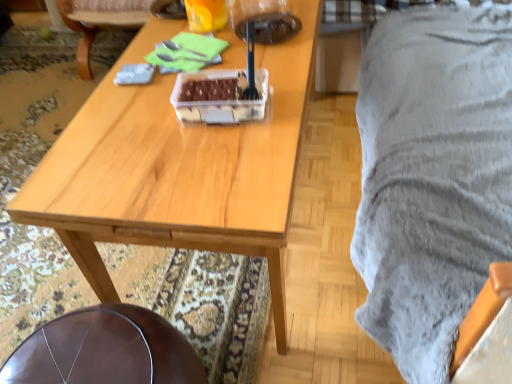
At what (x,y) coordinates should I click in order to perform the action: click on vacant space in front of translucent plastic container at center. Please return your answer as a coordinate pair (x, y). Looking at the image, I should click on (225, 157).